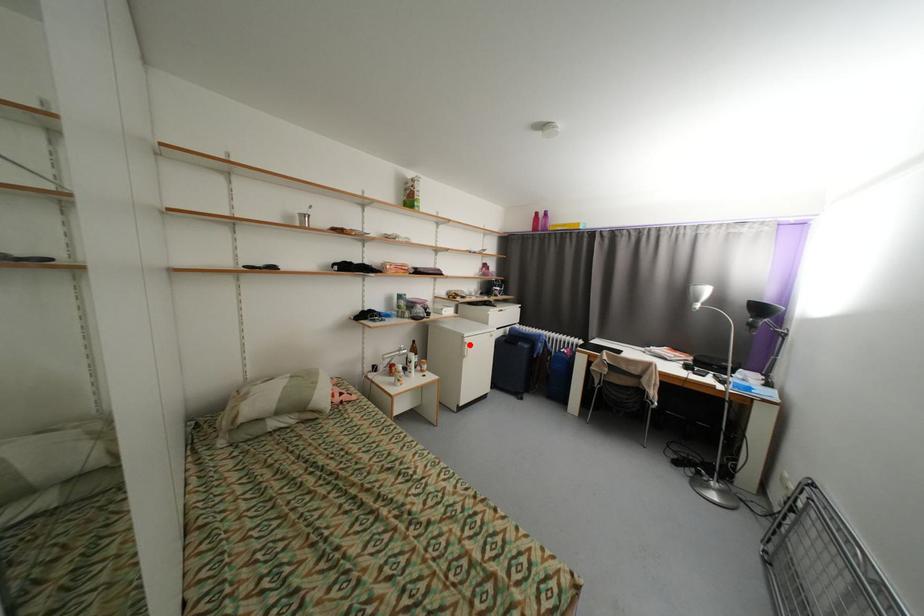
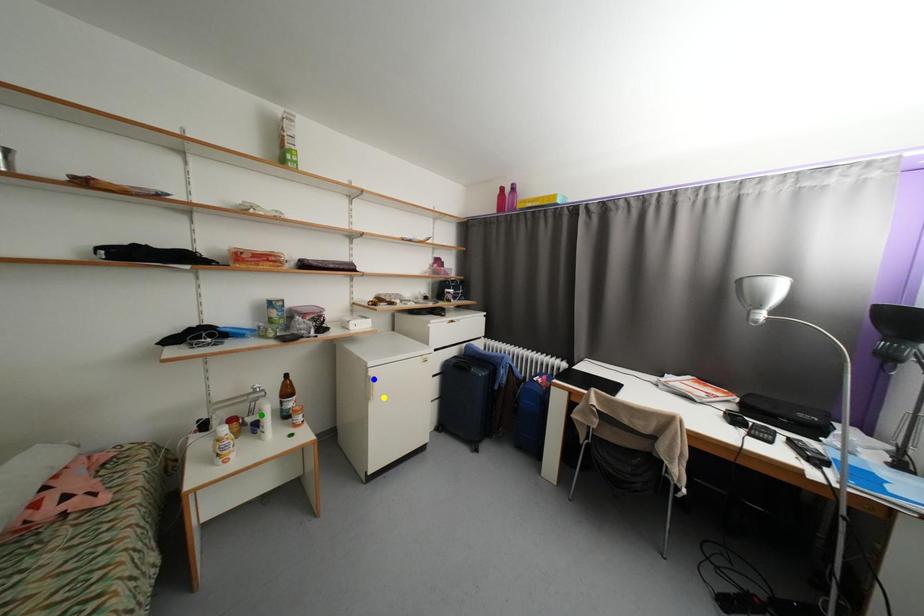
Question: I am providing you with two images of the same scene from different viewpoints. A red point is marked on the first image. You are given multiple points on the second image. In image 2, which mark is for the same physical point as the one in image 1?

Choices:
 (A) green point
 (B) yellow point
 (C) blue point

Answer: (C)